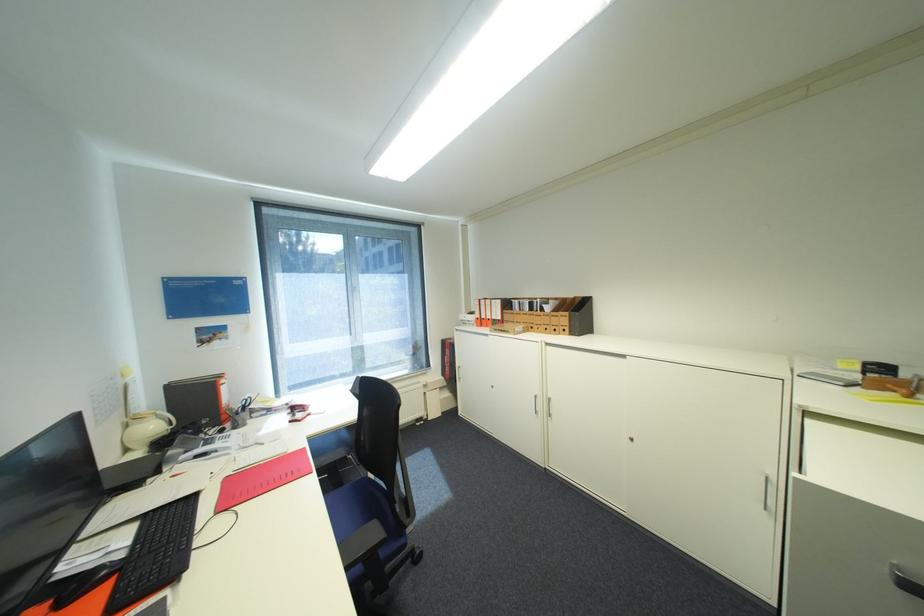
This screenshot has height=616, width=924. Find the location of `drawer handle`. drawer handle is located at coordinates (638, 440).